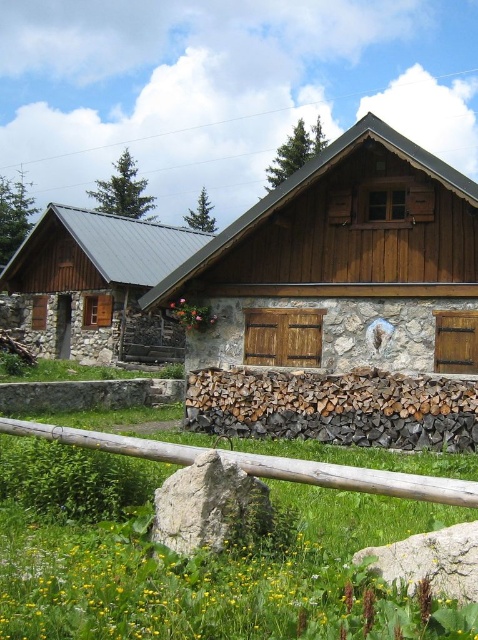
Does wooden cabin at center appear on the left side of gray rough rock at center?

Correct, you'll find wooden cabin at center to the left of gray rough rock at center.

Is wooden cabin at center below gray rough rock at center?

Incorrect, wooden cabin at center is not positioned below gray rough rock at center.

You are a GUI agent. You are given a task and a screenshot of the screen. Output one action in this format:
    pyautogui.click(x=<x>, y=<y>)
    Task: Click on the wooden cabin at center
    The image size is (478, 640).
    Given the screenshot: What is the action you would take?
    pyautogui.click(x=338, y=260)

Between point (29, 449) and point (459, 534), which one is positioned behind?

Point (29, 449)

Who is more forward, (285, 618) or (395, 577)?

Point (285, 618)

Locate an element on the screen. The height and width of the screenshot is (640, 478). green grass at center is located at coordinates coord(194,560).

The image size is (478, 640). Identify the location of green grass at center. (194, 560).

Is brown wooden fence at lower center shorter than gray rough rock at lower center?

Yes.

In the scene shown: Can you confirm if brown wooden fence at lower center is bigger than gray rough rock at lower center?

No, brown wooden fence at lower center is not bigger than gray rough rock at lower center.

Locate an element on the screen. This screenshot has width=478, height=640. brown wooden fence at lower center is located at coordinates (358, 477).